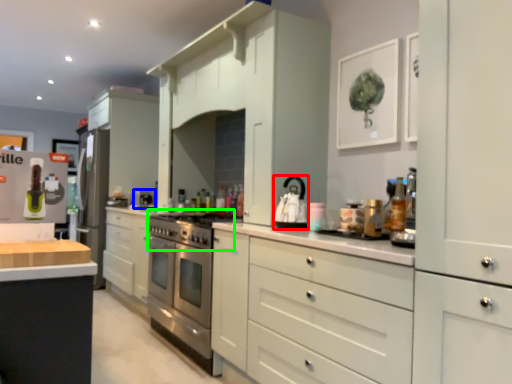
Question: Which object is the closest to the appliance (highlighted by a red box)? Choose among these: appliance (highlighted by a blue box) or gas stove (highlighted by a green box).

Choices:
 (A) appliance
 (B) gas stove

Answer: (B)